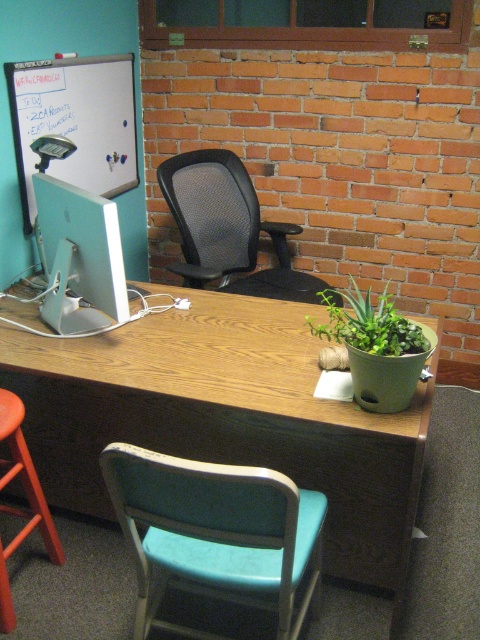
Question: Is wooden desk at center to the left of wooden bar stool at lower left from the viewer's perspective?

Choices:
 (A) yes
 (B) no

Answer: (B)

Question: Among these points, which one is farthest from the camera?

Choices:
 (A) (220, 316)
 (B) (389, 340)

Answer: (A)

Question: Which point appears farthest from the camera in this image?

Choices:
 (A) (262, 356)
 (B) (7, 477)
 (C) (216, 538)

Answer: (A)

Question: Is teal fabric chair at lower center behind white glossy computer monitor at left?

Choices:
 (A) yes
 (B) no

Answer: (B)

Question: Which of the following is the closest to the observer?

Choices:
 (A) wooden bar stool at lower left
 (B) teal fabric chair at lower center
 (C) white glossy computer monitor at left

Answer: (B)

Question: Is wooden desk at center wider than white glossy computer monitor at left?

Choices:
 (A) no
 (B) yes

Answer: (B)